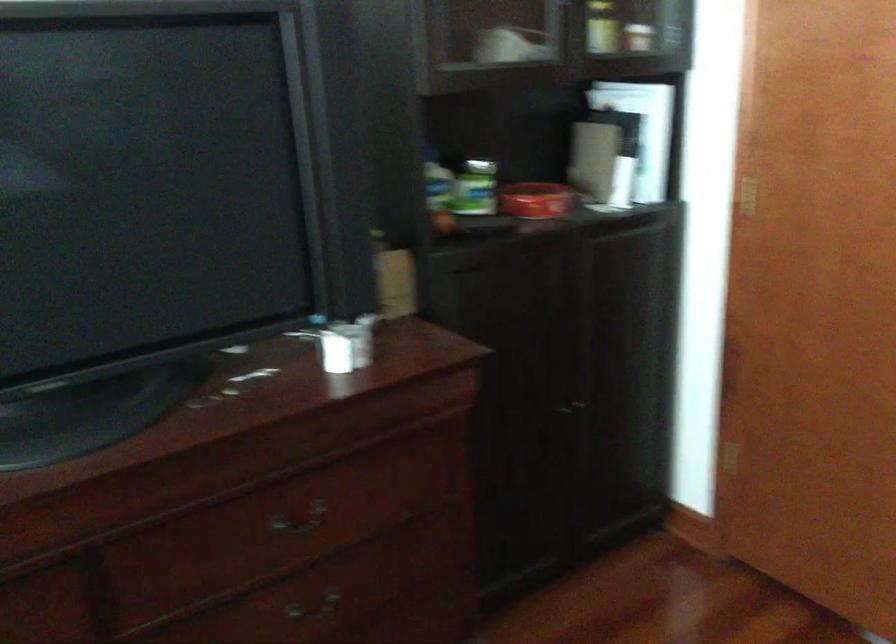
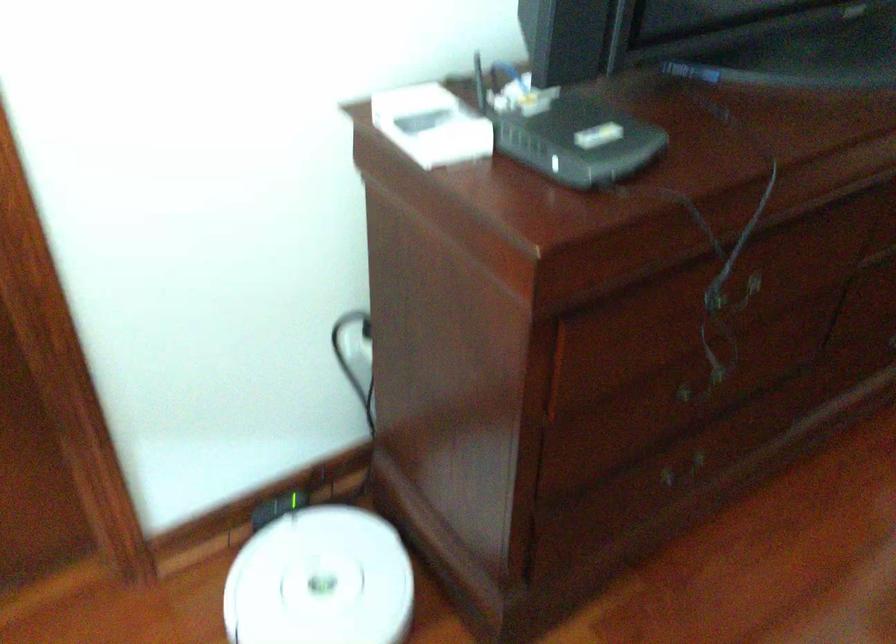
Question: Which direction would the cameraman need to move to produce the second image? Reply with the corresponding letter.

Choices:
 (A) Left
 (B) Right
 (C) Forward
 (D) Backward

Answer: (A)